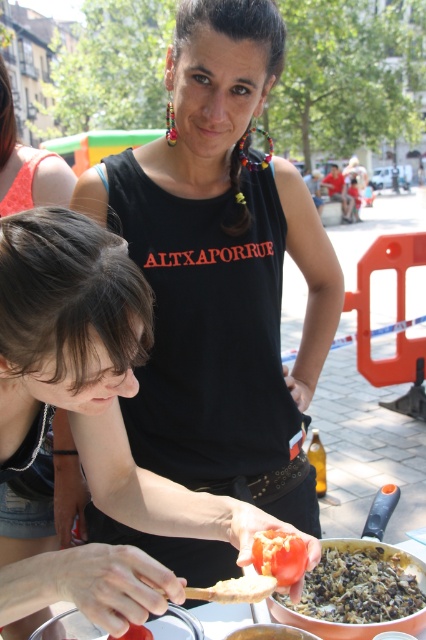
You are a photographer trying to capture a clear shot of the dark brown textured rice at lower right without the black matte tank top at center blocking it. Based on their positions, is this possible?

The dark brown textured rice at lower right is behind the black matte tank top at center, so it is blocked by the tank top and cannot be captured clearly without moving either object.

You are a photographer trying to capture the scene where the black matte tank top at center and the dark brown textured rice at lower right are both visible. Based on their positions, which object should you focus on first to ensure both are in frame?

The black matte tank top at center is located above the dark brown textured rice at lower right, so you should focus on the black matte tank top at center first to ensure both are in frame.

You are a chef preparing a dish and need to arrange ingredients on a plate. You have the dark brown textured rice at lower right and the red matte tomato at lower center. Based on their positions and sizes, which ingredient should you place first to ensure proper layering?

The dark brown textured rice at lower right should be placed first since it has a lesser height compared to the red matte tomato at lower center, allowing the taller tomato to be layered on top without obscuring the rice.